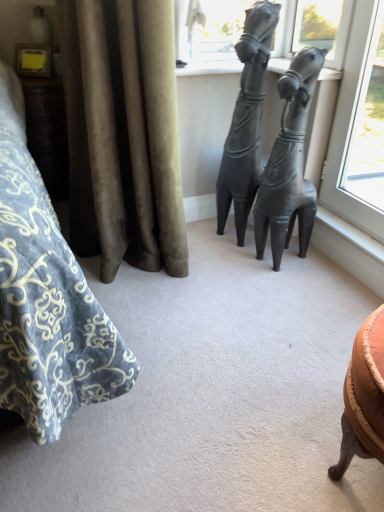
Question: Is point (92, 117) closer or farther from the camera than point (244, 121)?

Choices:
 (A) closer
 (B) farther

Answer: (A)

Question: Based on their sizes in the image, would you say velvet curtain at left is bigger or smaller than matte black statue at center, acting as the second statue (sculpture) starting from the right?

Choices:
 (A) small
 (B) big

Answer: (B)

Question: Based on their relative distances, which object is nearer to the matte black statue at center, acting as the second statue (sculpture) starting from the right?

Choices:
 (A) velvet curtain at left
 (B) matte black statue at center, positioned as the 2th statue (sculpture) in left-to-right order

Answer: (B)

Question: Which object is the closest to the matte black statue at center, which appears as the first statue (sculpture) when viewed from the right?

Choices:
 (A) matte black statue at center, the first statue (sculpture) in the left-to-right sequence
 (B) velvet curtain at left

Answer: (A)